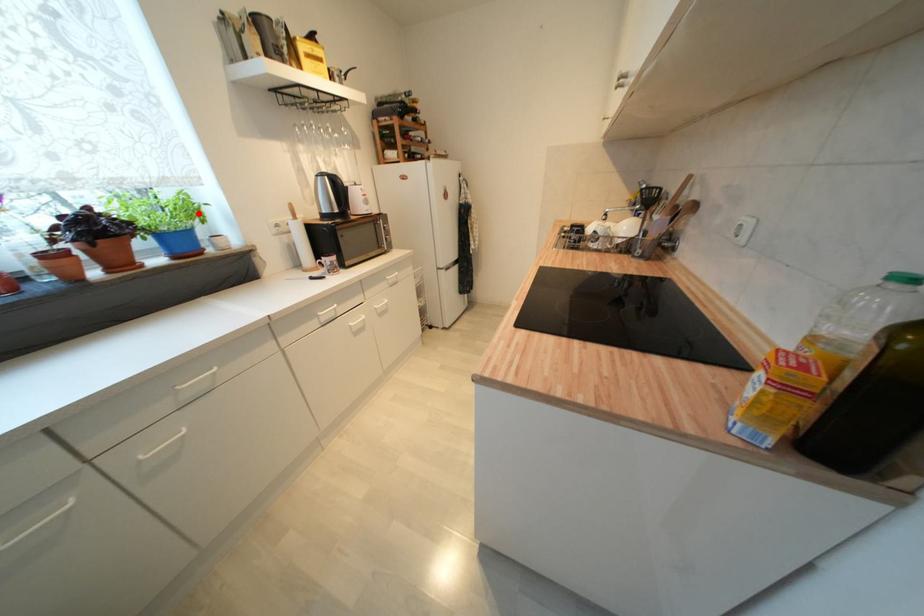
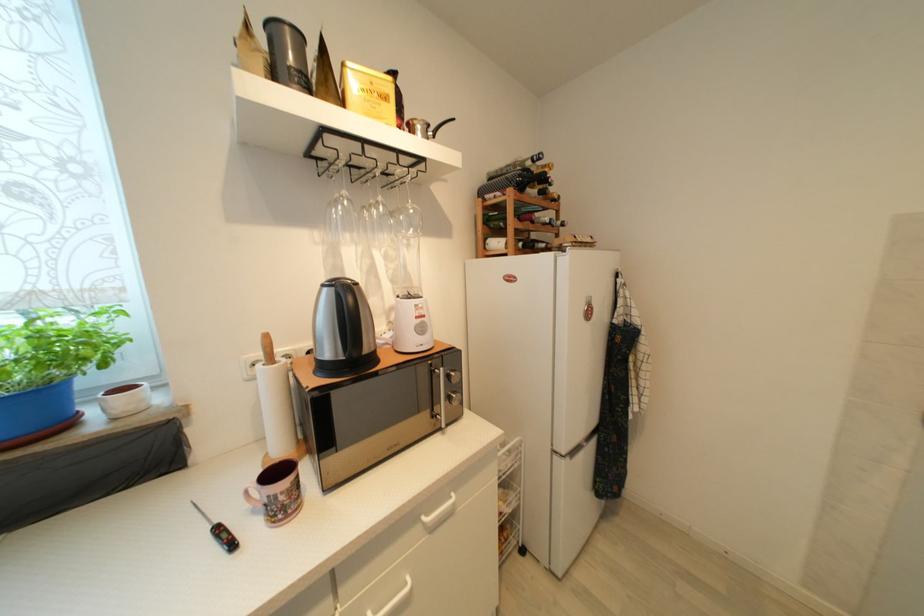
In the second image, find the point that corresponds to the highlighted location in the first image.

(77, 353)